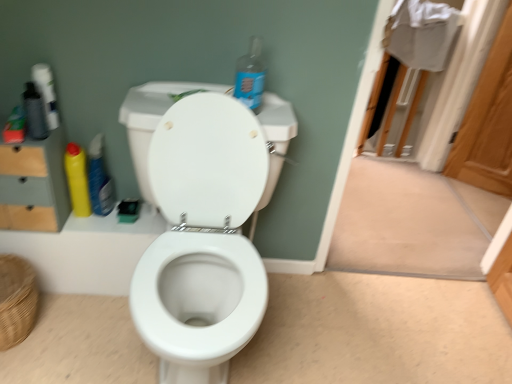
Measure the distance between woven brown basket at lower left and camera.

1.24 meters.

Where is `white glossy toilet at center`? white glossy toilet at center is located at coordinates (202, 239).

The image size is (512, 384). What do you see at coordinates (488, 122) in the screenshot?
I see `wooden screen door at upper right` at bounding box center [488, 122].

Describe the element at coordinates (77, 179) in the screenshot. This screenshot has height=384, width=512. I see `yellow matte bottle at left, the third cleaning product from the right` at that location.

How much space does blue plastic bottle at upper center, the third cleaning product positioned from the left, occupy horizontally?

blue plastic bottle at upper center, the third cleaning product positioned from the left, is 9.21 centimeters in width.

The width and height of the screenshot is (512, 384). Find the location of `woven brown basket at lower left`. woven brown basket at lower left is located at coordinates (16, 300).

From the image's perspective, who appears lower, wooden dresser at left or white glossy toilet at center?

white glossy toilet at center.

Considering the sizes of objects wooden dresser at left and white glossy toilet at center in the image provided, who is taller, wooden dresser at left or white glossy toilet at center?

white glossy toilet at center.

Considering the sizes of objects wooden dresser at left and white glossy toilet at center in the image provided, who is bigger, wooden dresser at left or white glossy toilet at center?

white glossy toilet at center is bigger.

Does point (35, 223) appear closer or farther from the camera than point (214, 376)?

Clearly, point (35, 223) is more distant from the camera than point (214, 376).

Based on the photo, is wooden dresser at left completely or partially outside of yellow plastic bottle at left, marked as the 2th cleaning product in a right-to-left arrangement?

Yes, wooden dresser at left is not within yellow plastic bottle at left, marked as the 2th cleaning product in a right-to-left arrangement.

Can you tell me how much wooden dresser at left and yellow plastic bottle at left, arranged as the second cleaning product when viewed from the left, differ in facing direction?

The angle between the facing direction of wooden dresser at left and the facing direction of yellow plastic bottle at left, arranged as the second cleaning product when viewed from the left, is 1.24 degrees.

Between point (59, 222) and point (88, 167), which one is positioned behind?

Positioned behind is point (59, 222).

Considering the relative positions of yellow plastic bottle at left, marked as the 2th cleaning product in a right-to-left arrangement, and white glossy toilet at center in the image provided, is yellow plastic bottle at left, marked as the 2th cleaning product in a right-to-left arrangement, to the left of white glossy toilet at center from the viewer's perspective?

Yes.

Is point (93, 205) farther from viewer compared to point (154, 330)?

Yes, point (93, 205) is farther from viewer.

The width and height of the screenshot is (512, 384). Find the location of `the 3rd cleaning product behind the white glossy toilet at center, counting from the anchor's position`. the 3rd cleaning product behind the white glossy toilet at center, counting from the anchor's position is located at coordinates (99, 179).

From the image's perspective, which one is positioned lower, blue plastic bottle at upper center, the third cleaning product positioned from the left, or wooden dresser at left?

wooden dresser at left, from the image's perspective.

Considering their positions, is blue plastic bottle at upper center, which appears as the first cleaning product when viewed from the right, located in front of or behind wooden dresser at left?

Visually, blue plastic bottle at upper center, which appears as the first cleaning product when viewed from the right, is located in front of wooden dresser at left.

Considering the sizes of objects blue plastic bottle at upper center, the third cleaning product positioned from the left, and wooden dresser at left in the image provided, who is thinner, blue plastic bottle at upper center, the third cleaning product positioned from the left, or wooden dresser at left?

Thinner between the two is blue plastic bottle at upper center, the third cleaning product positioned from the left.

Is blue plastic bottle at upper center, which appears as the first cleaning product when viewed from the right, oriented towards wooden dresser at left?

No, blue plastic bottle at upper center, which appears as the first cleaning product when viewed from the right, does not turn towards wooden dresser at left.

Can you tell me how much yellow plastic bottle at left, arranged as the second cleaning product when viewed from the left, and wooden dresser at left differ in facing direction?

They differ by 1.24 degrees in their facing directions.

Is yellow plastic bottle at left, marked as the 2th cleaning product in a right-to-left arrangement, wider or thinner than wooden dresser at left?

Clearly, yellow plastic bottle at left, marked as the 2th cleaning product in a right-to-left arrangement, has less width compared to wooden dresser at left.

Are yellow plastic bottle at left, arranged as the second cleaning product when viewed from the left, and wooden dresser at left far apart?

They are positioned close to each other.

From the image's perspective, between yellow plastic bottle at left, marked as the 2th cleaning product in a right-to-left arrangement, and wooden dresser at left, who is located below?

yellow plastic bottle at left, marked as the 2th cleaning product in a right-to-left arrangement.

From their relative heights in the image, would you say yellow matte bottle at left, which ranks as the 1th cleaning product in left-to-right order, is taller or shorter than wooden dresser at left?

In the image, yellow matte bottle at left, which ranks as the 1th cleaning product in left-to-right order, appears to be shorter than wooden dresser at left.

Consider the image. From the image's perspective, between yellow matte bottle at left, the third cleaning product from the right, and wooden dresser at left, which one is located above?

wooden dresser at left, from the image's perspective.

Can you confirm if yellow matte bottle at left, the third cleaning product from the right, is smaller than wooden dresser at left?

Yes, yellow matte bottle at left, the third cleaning product from the right, is smaller than wooden dresser at left.

Based on their positions, is yellow matte bottle at left, the third cleaning product from the right, located to the left or right of wooden dresser at left?

yellow matte bottle at left, the third cleaning product from the right, is to the right of wooden dresser at left.

Between woven brown basket at lower left and blue plastic bottle at upper center, the third cleaning product positioned from the left, which one has larger width?

Wider between the two is woven brown basket at lower left.

Which is behind, woven brown basket at lower left or blue plastic bottle at upper center, which appears as the first cleaning product when viewed from the right?

woven brown basket at lower left is more distant.

From a real-world perspective, between woven brown basket at lower left and blue plastic bottle at upper center, which appears as the first cleaning product when viewed from the right, who is vertically lower?

In real-world perspective, woven brown basket at lower left is lower.

Is point (6, 305) farther from camera compared to point (246, 91)?

Yes, point (6, 305) is behind point (246, 91).

Locate an element on the screen. The image size is (512, 384). toilet in front of the wooden dresser at left is located at coordinates (202, 239).

Identify the location of dresser above the yellow plastic bottle at left, arranged as the second cleaning product when viewed from the left (from the image's perspective). The image size is (512, 384). (34, 184).

Which object lies further to the anchor point white glossy toilet at center, yellow matte bottle at left, which ranks as the 1th cleaning product in left-to-right order, or blue plastic bottle at upper center, which appears as the first cleaning product when viewed from the right?

Based on the image, yellow matte bottle at left, which ranks as the 1th cleaning product in left-to-right order, appears to be further to white glossy toilet at center.

Considering their positions, is yellow plastic bottle at left, arranged as the second cleaning product when viewed from the left, positioned closer to woven brown basket at lower left than yellow matte bottle at left, which ranks as the 1th cleaning product in left-to-right order?

Among the two, yellow matte bottle at left, which ranks as the 1th cleaning product in left-to-right order, is located nearer to woven brown basket at lower left.

Looking at the image, which one is located further to wooden dresser at left, wooden screen door at upper right or yellow plastic bottle at left, arranged as the second cleaning product when viewed from the left?

Among the two, wooden screen door at upper right is located further to wooden dresser at left.

Which object lies further to the anchor point yellow plastic bottle at left, marked as the 2th cleaning product in a right-to-left arrangement, yellow matte bottle at left, which ranks as the 1th cleaning product in left-to-right order, or white glossy toilet at center?

white glossy toilet at center.

Considering their positions, is woven brown basket at lower left positioned closer to wooden dresser at left than white glossy toilet at center?

The object closer to wooden dresser at left is woven brown basket at lower left.

Looking at the image, which one is located closer to yellow matte bottle at left, the third cleaning product from the right, white glossy toilet at center or yellow plastic bottle at left, marked as the 2th cleaning product in a right-to-left arrangement?

Based on the image, yellow plastic bottle at left, marked as the 2th cleaning product in a right-to-left arrangement, appears to be nearer to yellow matte bottle at left, the third cleaning product from the right.

Based on their spatial positions, is wooden screen door at upper right or yellow matte bottle at left, which ranks as the 1th cleaning product in left-to-right order, further from wooden dresser at left?

wooden screen door at upper right is positioned further to the anchor wooden dresser at left.

When comparing their distances from woven brown basket at lower left, does wooden dresser at left or blue plastic bottle at upper center, which appears as the first cleaning product when viewed from the right, seem further?

Based on the image, blue plastic bottle at upper center, which appears as the first cleaning product when viewed from the right, appears to be further to woven brown basket at lower left.

Find the location of a particular element. The width and height of the screenshot is (512, 384). cleaning product between white glossy toilet at center and yellow matte bottle at left, the third cleaning product from the right, from front to back is located at coordinates (250, 76).

At what (x,y) coordinates should I click in order to perform the action: click on dresser located between white glossy toilet at center and yellow matte bottle at left, which ranks as the 1th cleaning product in left-to-right order, in the depth direction. Please return your answer as a coordinate pair (x, y). Looking at the image, I should click on (34, 184).

Where is `dresser between woven brown basket at lower left and blue plastic bottle at upper center, the third cleaning product positioned from the left, in the horizontal direction`? The height and width of the screenshot is (384, 512). dresser between woven brown basket at lower left and blue plastic bottle at upper center, the third cleaning product positioned from the left, in the horizontal direction is located at coordinates (34, 184).

The image size is (512, 384). I want to click on toilet situated between wooden dresser at left and blue plastic bottle at upper center, which appears as the first cleaning product when viewed from the right, from left to right, so click(202, 239).